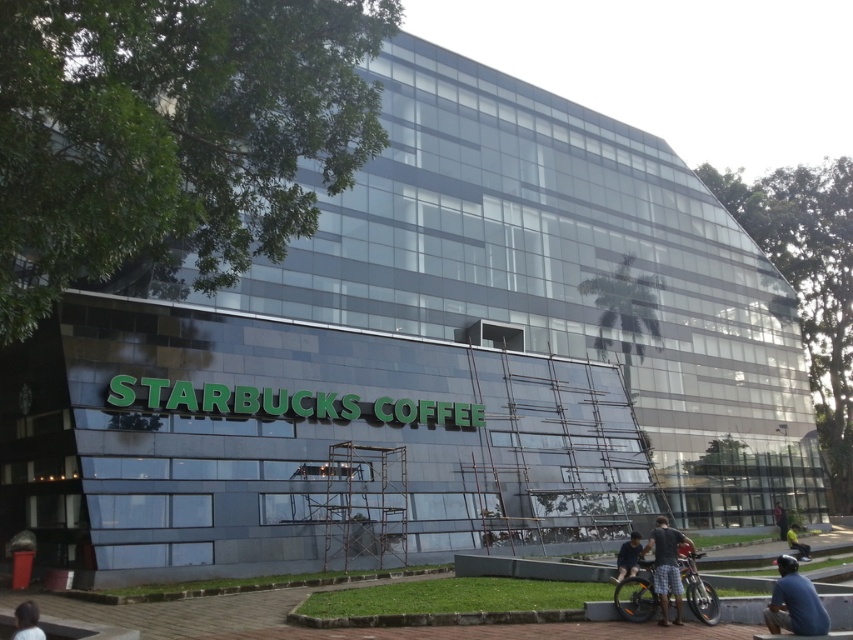
Question: Does dark blue shirt at lower left appear on the left side of dark blue jeans at lower right?

Choices:
 (A) no
 (B) yes

Answer: (B)

Question: Which of the following is the closest to the observer?

Choices:
 (A) yellow fabric jacket at lower right
 (B) dark blue jeans at lower center
 (C) orange matte bicycle at lower right
 (D) plaid shorts at lower center

Answer: (D)

Question: Can you confirm if plaid shorts at lower center is positioned above dark blue shirt at lower left?

Choices:
 (A) yes
 (B) no

Answer: (B)

Question: Which of the following is the closest to the observer?

Choices:
 (A) (625, 564)
 (B) (778, 522)
 (C) (642, 600)
 (D) (15, 621)

Answer: (D)

Question: Does dark blue shirt at lower left lie behind dark blue jeans at lower center?

Choices:
 (A) no
 (B) yes

Answer: (A)

Question: Which of the following is the farthest from the observer?

Choices:
 (A) yellow fabric jacket at lower right
 (B) dark blue jeans at lower center

Answer: (A)